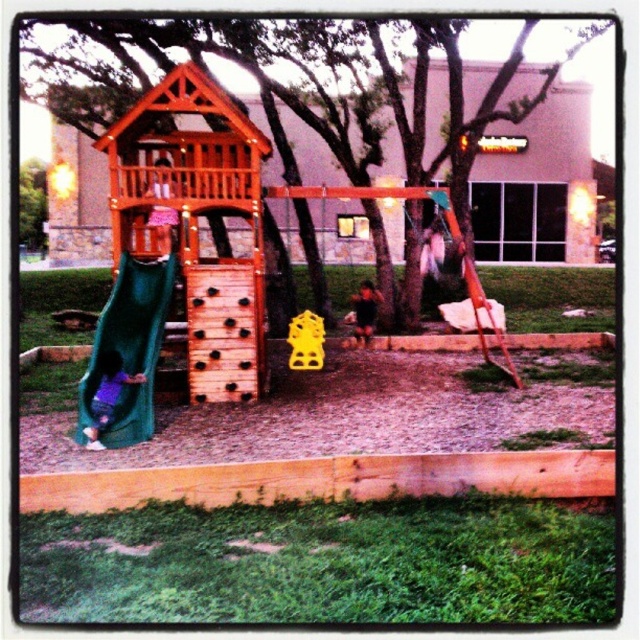
You are a parent supervising children at the playground. You notice the purple fabric slide at lower left and the dark brown hair at center. Which object is positioned to the left of the other?

The purple fabric slide at lower left is to the left of dark brown hair at center.

You are a parent at the playground and see your child with dark brown hair at center and the green fabric slide at left. Which object is closer to the ground?

The green fabric slide at left is closer to the ground because it is located below the dark brown hair at center.